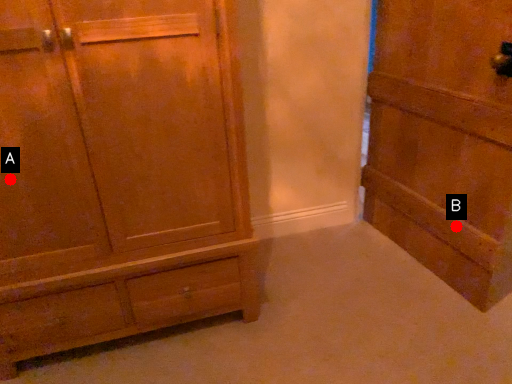
Question: Two points are circled on the image, labeled by A and B beside each circle. Which point is further to the camera?

Choices:
 (A) A is further
 (B) B is further

Answer: (B)